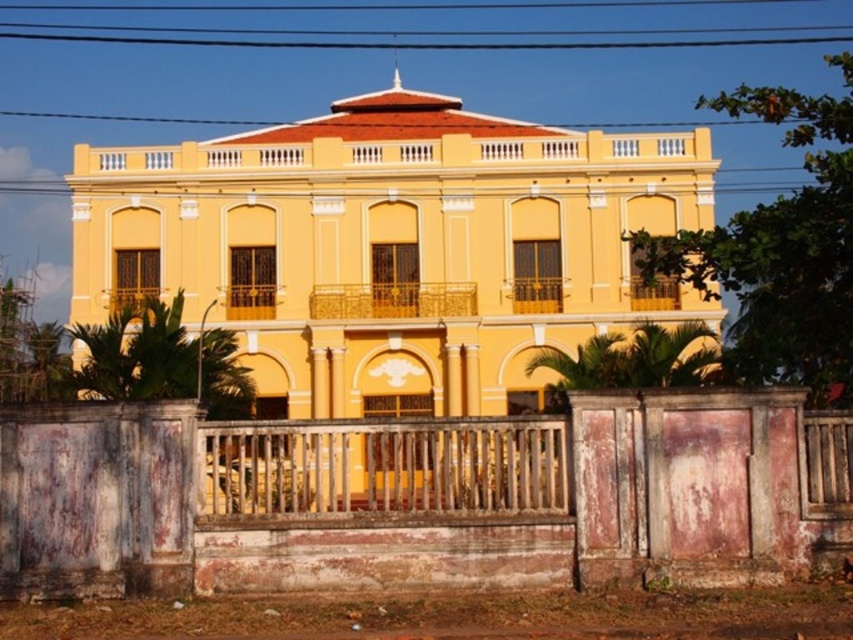
Question: Does rusty wooden fence at center appear on the right side of wooden at center?

Choices:
 (A) yes
 (B) no

Answer: (B)

Question: Which point is closer to the camera?

Choices:
 (A) (x=134, y=518)
 (B) (x=486, y=474)
 (C) (x=318, y=42)

Answer: (A)

Question: Which of the following is the farthest from the observer?

Choices:
 (A) black wire at upper center
 (B) wooden at center

Answer: (A)

Question: Which point appears closest to the camera in this image?

Choices:
 (A) (234, 488)
 (B) (589, 416)
 (C) (161, 42)

Answer: (B)

Question: Is rusty wooden fence at center to the right of wooden at center from the viewer's perspective?

Choices:
 (A) yes
 (B) no

Answer: (B)

Question: Can you confirm if rusty wooden fence at center is bigger than black wire at upper center?

Choices:
 (A) yes
 (B) no

Answer: (A)